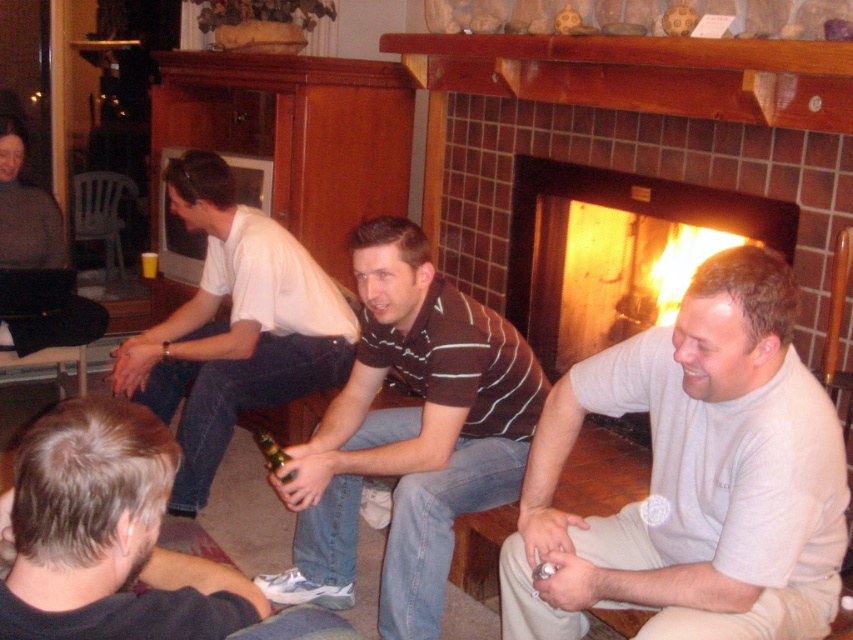
You are standing in the living room and want to pick up the white turtleneck sweater at lower right and the denim jeans at lower left. Which item will you need to reach for first because it is closer to you?

The white turtleneck sweater at lower right is closer to you than the denim jeans at lower left, so you should reach for the white turtleneck sweater at lower right first.

You are a photographer setting up a shot of the scene by the fireplace. You notice the striped polo shirt at center and denim jeans at lower left. Which item is covering part of the other?

The striped polo shirt at center is positioned over denim jeans at lower left, so it is covering part of the denim jeans at lower left.

You are a photographer trying to capture a candid shot of the two people wearing the white turtleneck sweater at lower right and the striped polo shirt at center. Given that your camera has a minimum focus distance of 20 inches, will you be able to clearly capture both subjects in the same frame without moving closer?

The white turtleneck sweater at lower right and striped polo shirt at center are 21.54 inches apart from each other, which exceeds the camera minimum focus distance of 20 inches. Therefore, the photographer can capture both subjects in the same frame without moving closer.